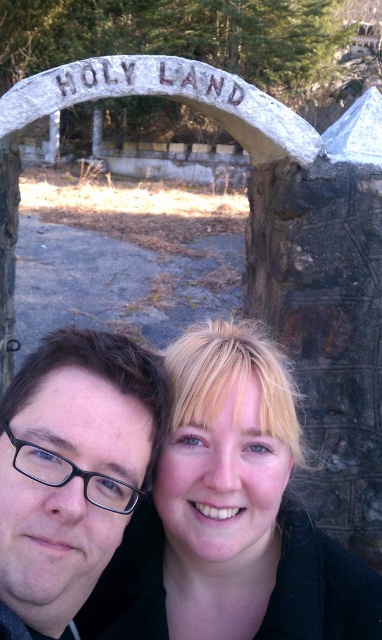
Based on the scene description, which object at the center has a greater width when viewed from the observer perspective? Please choose between the blonde hair at center and the matte black glasses at center.

The blonde hair at center is wider than the matte black glasses at center according to the description provided.

Consider the image. You are a photographer trying to adjust the focus on your camera. You need to ensure that both the blonde hair at center and the matte black glasses at center are in focus. Given their positions, which object should you focus on first to ensure both are sharp?

The blonde hair at center has a greater height compared to matte black glasses at center, so you should focus on the blonde hair at center first to ensure both are in focus.

You are a photographer trying to adjust the lighting for a photo of two people. You notice the blonde hair at center and the matte black glasses at center. Which object should you focus on first to ensure proper exposure, considering their positions?

The blonde hair at center is positioned under matte black glasses at center, so you should focus on the matte black glasses at center first to ensure proper exposure, as it is above the blonde hair and might require more attention due to its darker color contrasting with the lighter hair.